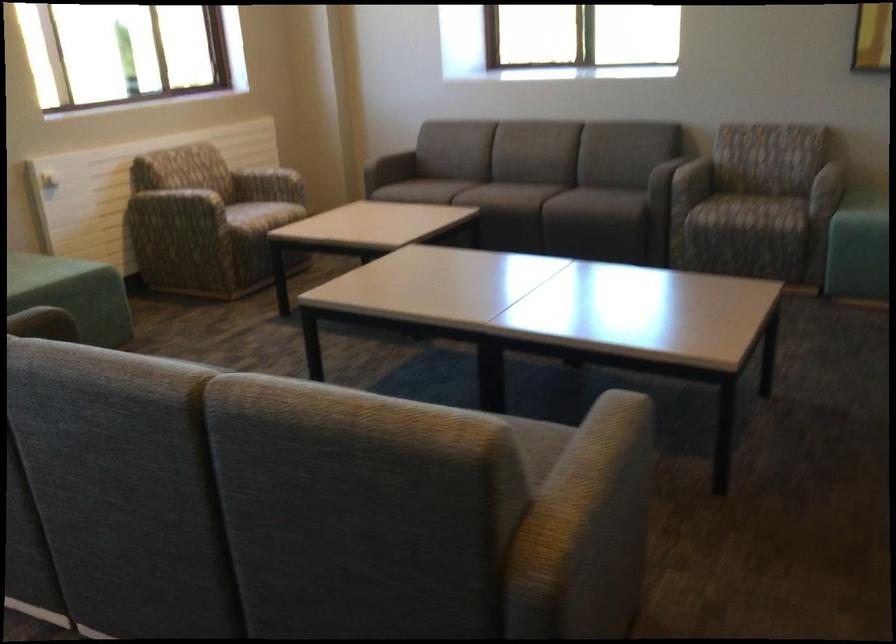
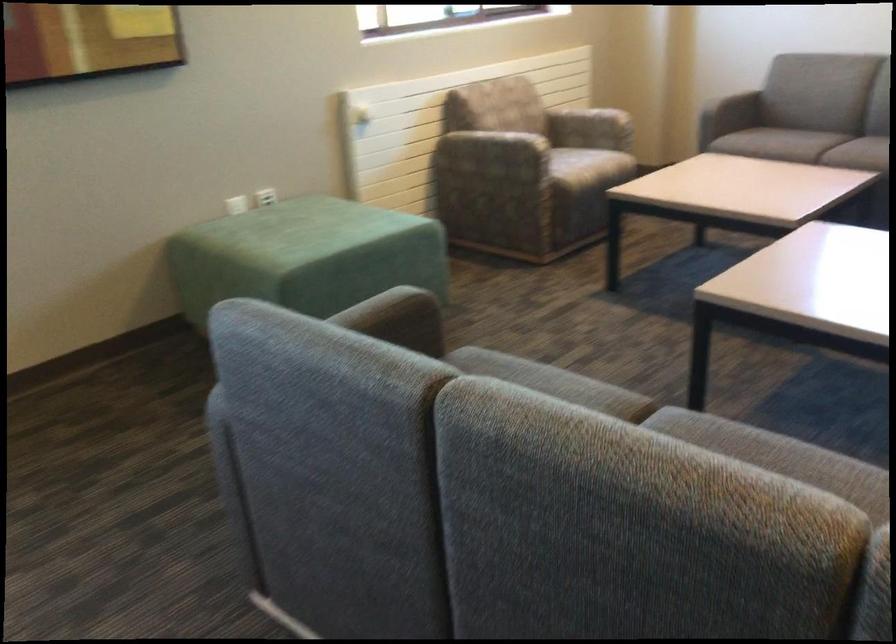
Question: The camera is either moving clockwise (left) or counter-clockwise (right) around the object. The first image is from the beginning of the video and the second image is from the end. Is the camera moving left or right when shooting the video?

Choices:
 (A) Left
 (B) Right

Answer: (B)